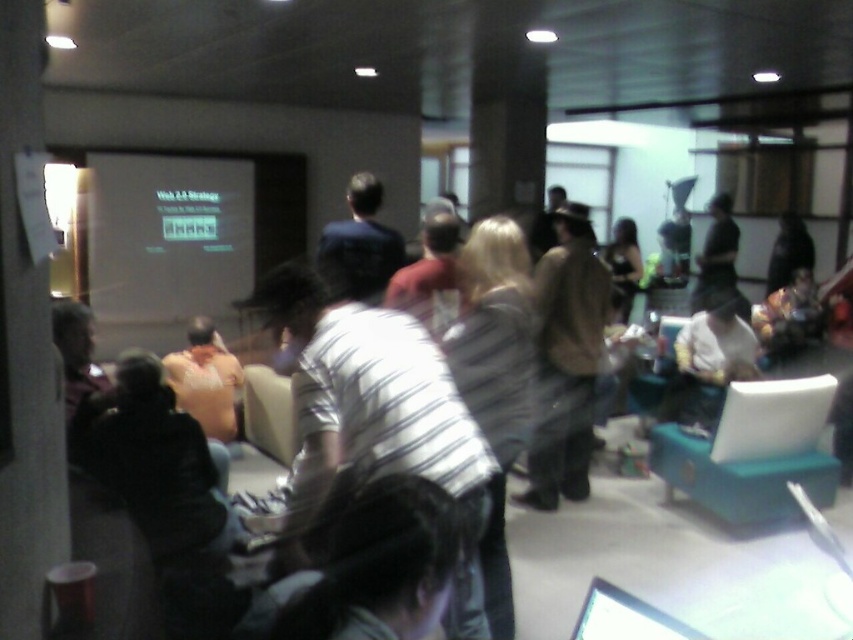
You are standing at the entrance of the room and want to see both the matte white projector screen at left and the dark blue shirt at center. Which object is closer to you?

The matte white projector screen at left is closer to you because it is further to the viewer than the dark blue shirt at center.

You are organizing a coat rack for the attendees of this meeting. You have two items to place on the rack. The brown leather jacket at center and the dark blue shirt at center. Which item should you place first to ensure both fit properly on the rack?

Answer: The brown leather jacket at center has a larger size compared to the dark blue shirt at center, so you should place the brown leather jacket at center first to accommodate its larger size before placing the dark blue shirt at center.